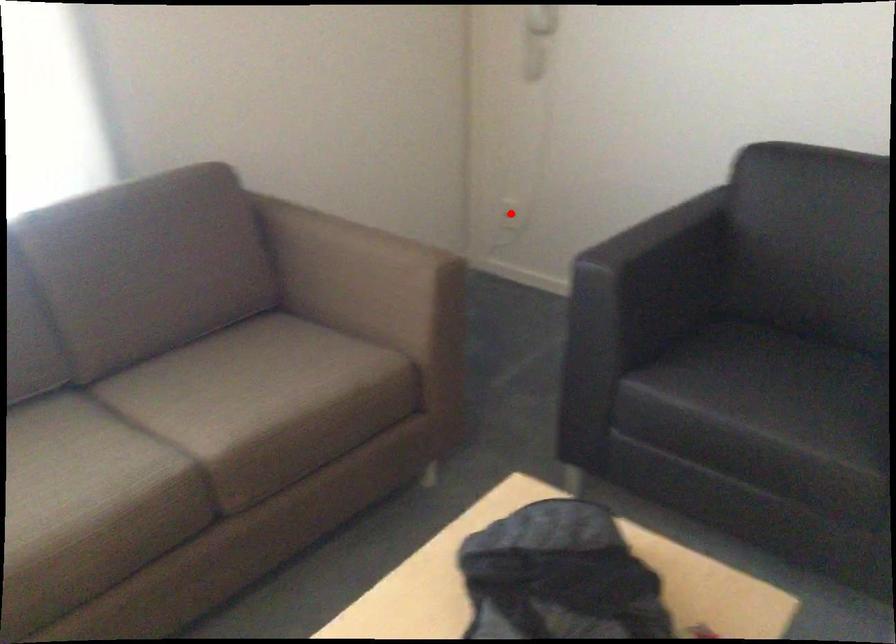
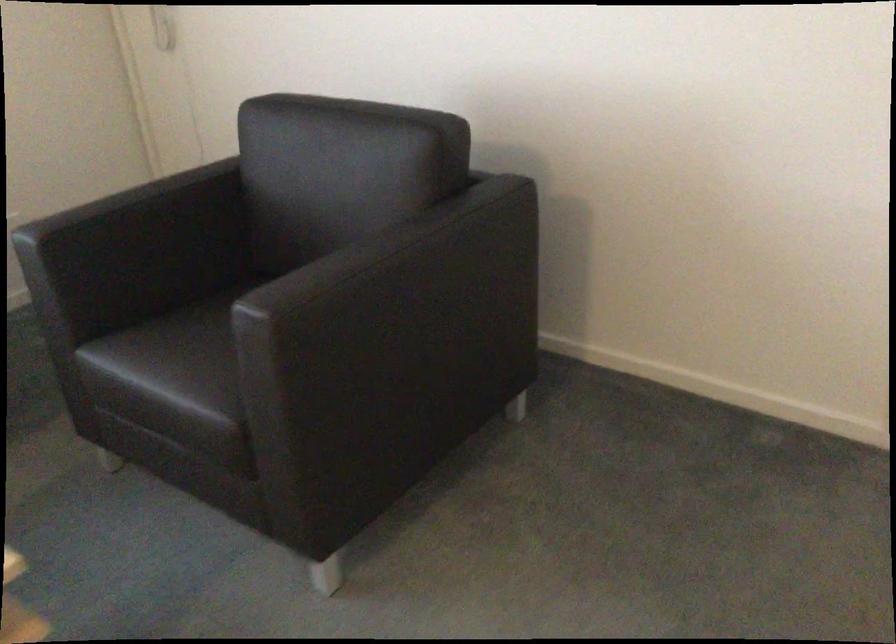
Question: I am providing you with two images of the same scene from different viewpoints. A red point is marked on the first image. Is the red point's position out of view in image 2?

Choices:
 (A) Yes
 (B) No

Answer: (A)